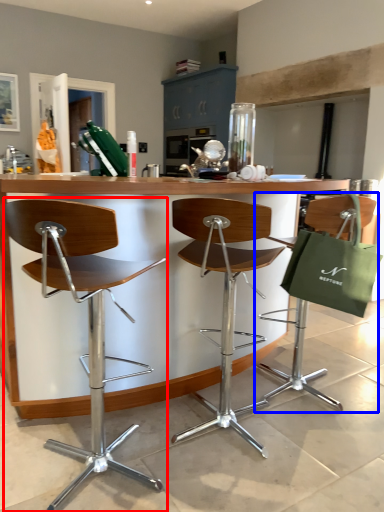
Question: Which object is further to the camera taking this photo, chair (highlighted by a red box) or chair (highlighted by a blue box)?

Choices:
 (A) chair
 (B) chair

Answer: (B)